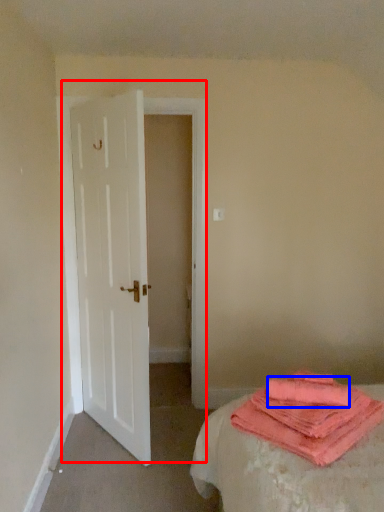
Question: Among these objects, which one is nearest to the camera, door (highlighted by a red box) or beach towel (highlighted by a blue box)?

Choices:
 (A) door
 (B) beach towel

Answer: (B)